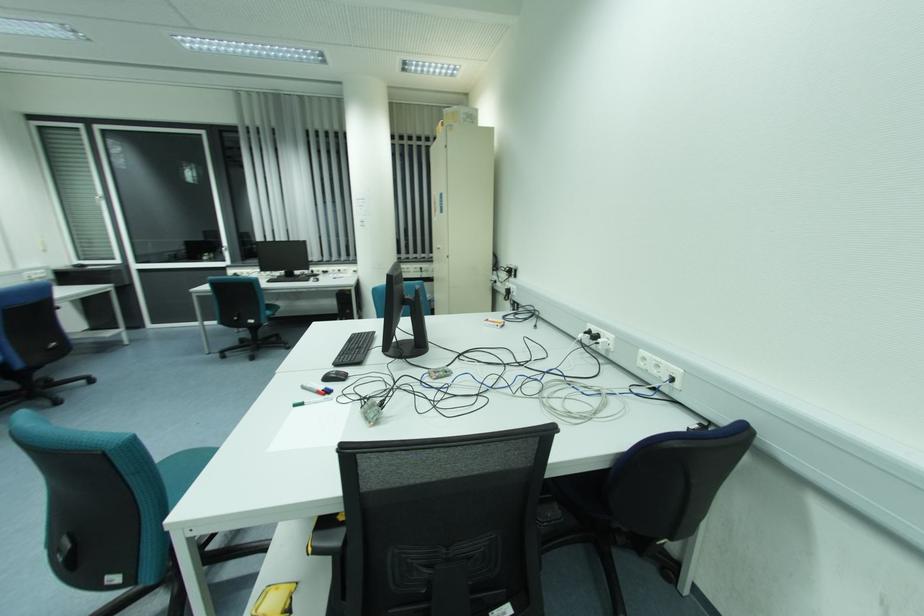
Identify the location of red marker. This screenshot has width=924, height=616. (314, 389).